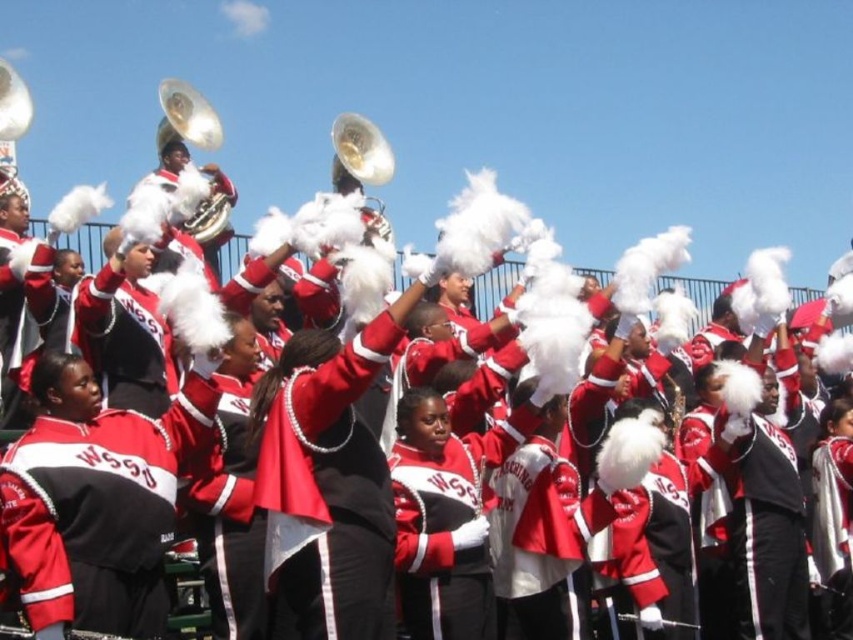
Is red matte jacket at center positioned behind shiny brass tuba at upper left?

No, red matte jacket at center is in front of shiny brass tuba at upper left.

Is red matte jacket at center closer to the viewer compared to shiny brass tuba at upper left?

Yes, red matte jacket at center is in front of shiny brass tuba at upper left.

Between point (796, 588) and point (207, 134), which one is positioned in front?

Point (796, 588) is more forward.

Where is `red matte jacket at center`? The image size is (853, 640). red matte jacket at center is located at coordinates (766, 534).

Which of these two, matte red jacket at center or shiny brass tuba at upper left, stands shorter?

With less height is shiny brass tuba at upper left.

Describe the element at coordinates (328, 484) in the screenshot. I see `matte red jacket at center` at that location.

You are a GUI agent. You are given a task and a screenshot of the screen. Output one action in this format:
    pyautogui.click(x=<x>, y=<y>)
    Task: Click on the matte red jacket at center
    
    Given the screenshot: What is the action you would take?
    pyautogui.click(x=328, y=484)

Does matte red jacket at center lie in front of red matte jacket at center?

Yes, matte red jacket at center is closer to the viewer.

Can you confirm if matte red jacket at center is shorter than red matte jacket at center?

In fact, matte red jacket at center may be taller than red matte jacket at center.

Where is `matte red jacket at center`? matte red jacket at center is located at coordinates (328, 484).